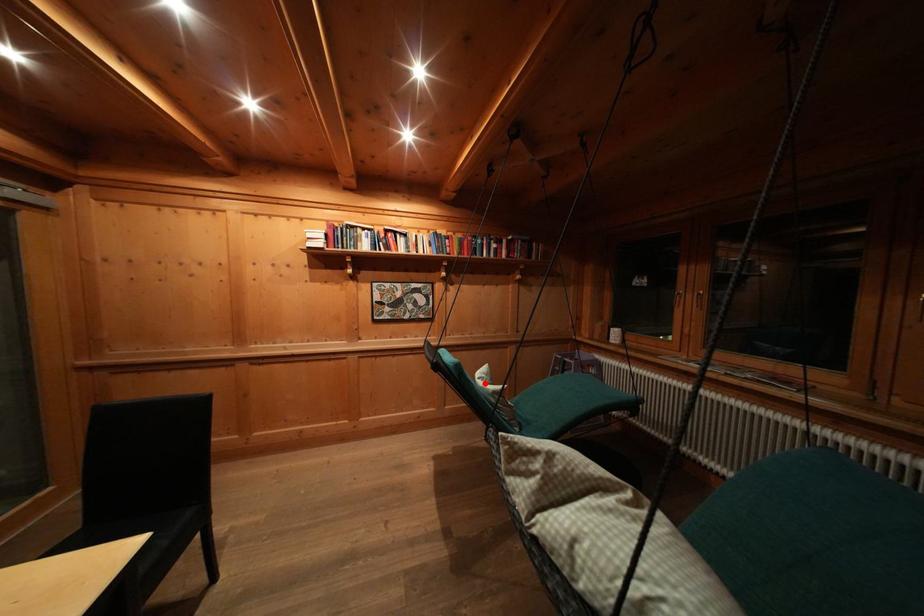
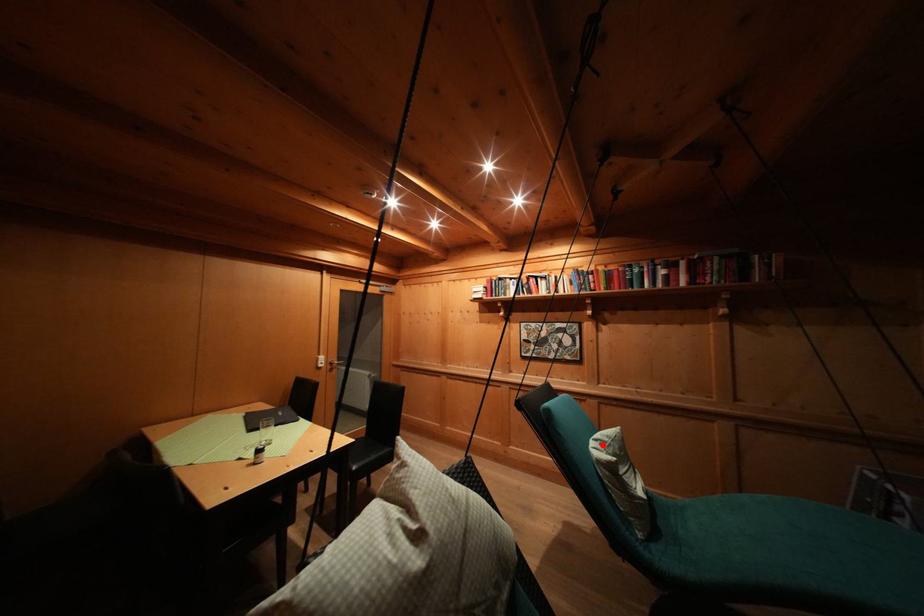
I am providing you with two images of the same scene from different viewpoints. A red point is marked on the first image and another point is marked on the second image. Does the point marked in image1 correspond to the same location as the one in image2?

Yes